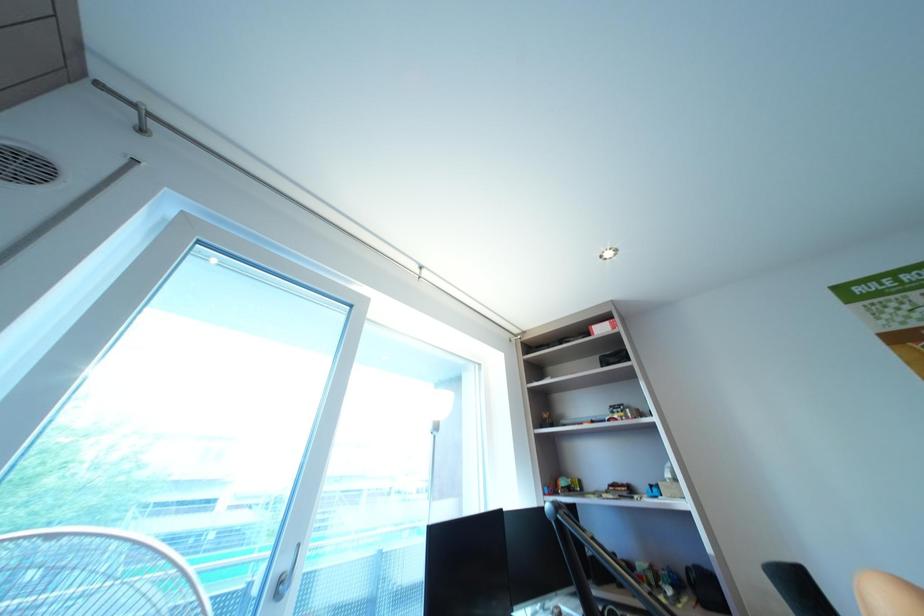
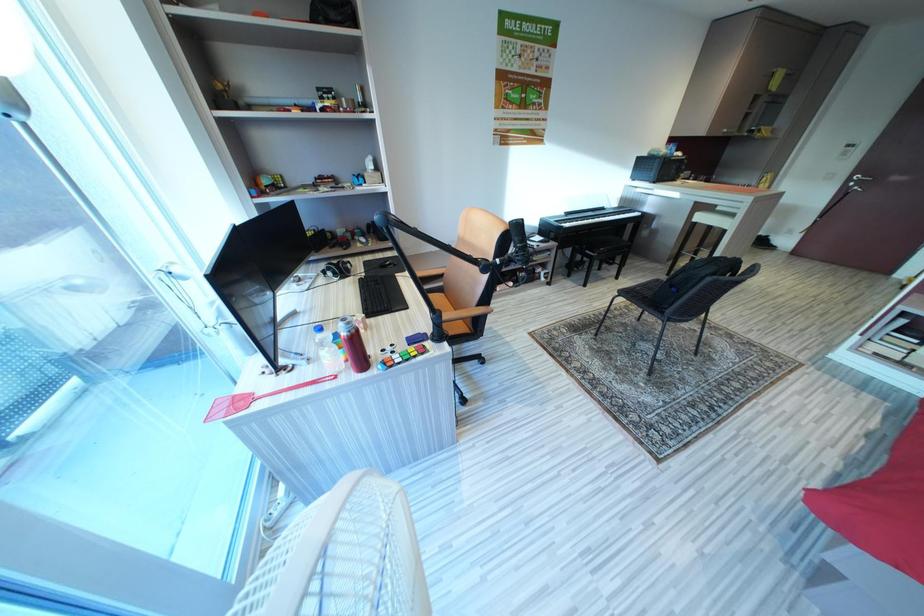
The first image is from the beginning of the video and the second image is from the end. How did the camera likely rotate when shooting the video?

The camera rotated toward right-down.